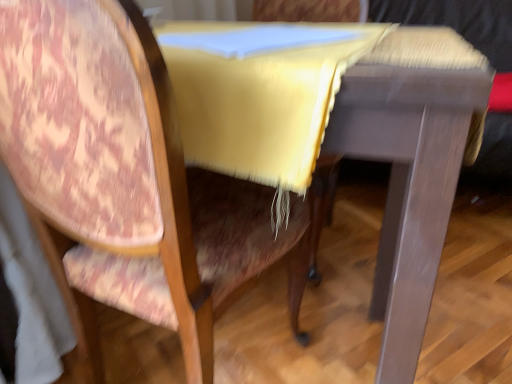
Question: Considering the positions of wooden table at center and velvet-like pink chair at left in the image, is wooden table at center taller or shorter than velvet-like pink chair at left?

Choices:
 (A) short
 (B) tall

Answer: (A)

Question: From the image's perspective, is wooden table at center positioned above or below velvet-like pink chair at left?

Choices:
 (A) above
 (B) below

Answer: (A)

Question: Considering the positions of wooden table at center and velvet-like pink chair at left in the image, is wooden table at center bigger or smaller than velvet-like pink chair at left?

Choices:
 (A) big
 (B) small

Answer: (A)

Question: Relative to wooden table at center, is velvet-like pink chair at left in front or behind?

Choices:
 (A) front
 (B) behind

Answer: (A)

Question: Would you say velvet-like pink chair at left is inside or outside wooden table at center?

Choices:
 (A) outside
 (B) inside

Answer: (B)

Question: Looking at the image, does velvet-like pink chair at left seem bigger or smaller compared to wooden table at center?

Choices:
 (A) big
 (B) small

Answer: (B)

Question: From the image's perspective, is velvet-like pink chair at left positioned above or below wooden table at center?

Choices:
 (A) below
 (B) above

Answer: (A)